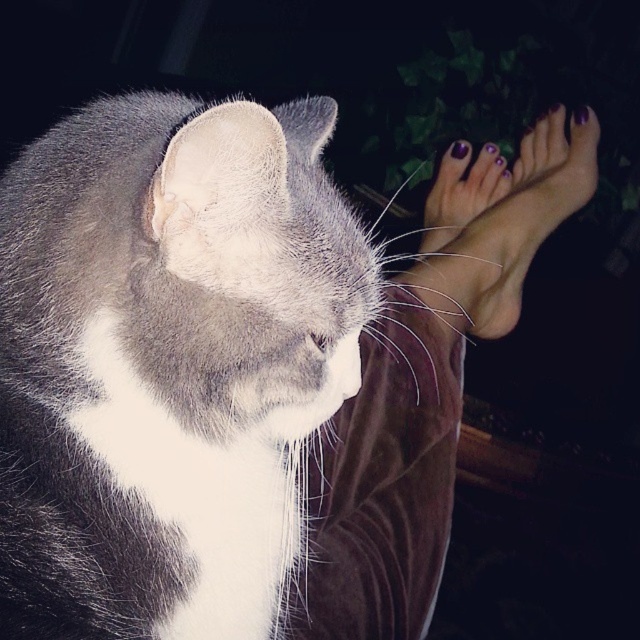
Question: Can you confirm if gray-white fur cat at center is thinner than purple nail polish toe at upper right?

Choices:
 (A) no
 (B) yes

Answer: (A)

Question: Which point is farther from the camera taking this photo?

Choices:
 (A) (x=429, y=298)
 (B) (x=502, y=161)

Answer: (B)

Question: In this image, where is purple nail polish toes at upper right located relative to purple nail polish toe at upper right?

Choices:
 (A) right
 (B) left

Answer: (B)

Question: Is purple nail polish at center above purple painted toe at upper right?

Choices:
 (A) no
 (B) yes

Answer: (B)

Question: Which object appears closest to the camera in this image?

Choices:
 (A) gray-white fur cat at center
 (B) purple nail polish toes at upper right

Answer: (A)

Question: Considering the real-world distances, which object is farthest from the gray-white fur cat at center?

Choices:
 (A) purple painted nails at upper right
 (B) purple nail polish toes at upper right
 (C) purple nail polish toe at upper center
 (D) purple nail polish toe at upper right

Answer: (D)